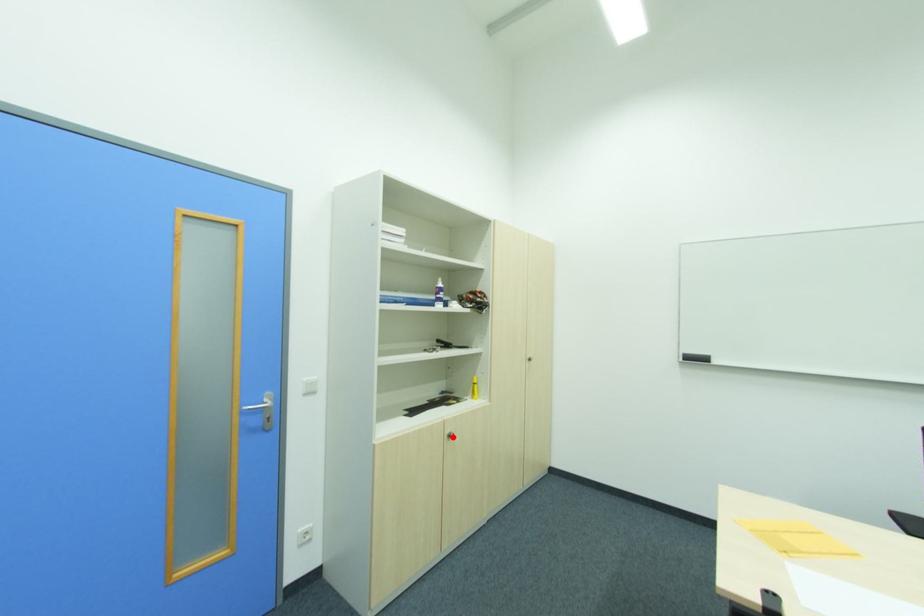
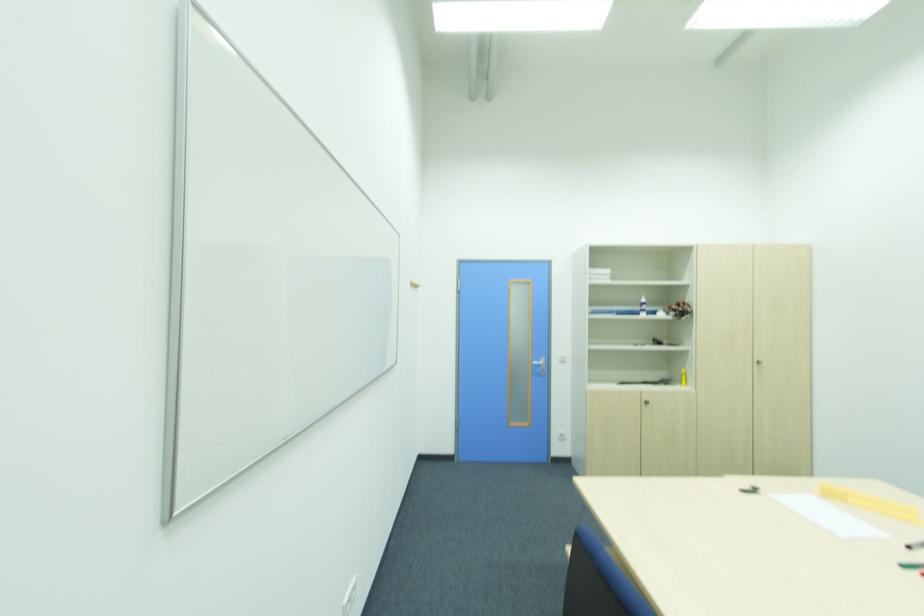
The point at the highlighted location is marked in the first image. Where is the corresponding point in the second image?

(650, 402)